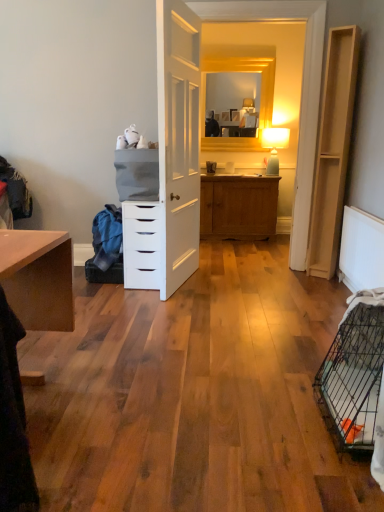
What do you see at coordinates (333, 150) in the screenshot?
I see `light wood/file cabinet at right` at bounding box center [333, 150].

Measure the distance between point (312,227) and camera.

The depth of point (312,227) is 3.80 meters.

This screenshot has width=384, height=512. Describe the element at coordinates (361, 250) in the screenshot. I see `white textured radiator at lower right` at that location.

What are the coordinates of `white matte chest of drawers at center` in the screenshot? It's located at (141, 244).

At what (x,y) coordinates should I click in order to perform the action: click on light wood/file cabinet at right. Please return your answer as a coordinate pair (x, y). This screenshot has height=512, width=384. Looking at the image, I should click on (333, 150).

From the image's perspective, which is above, white textured radiator at lower right or blue fabric at left?

From the image's view, blue fabric at left is above.

Is point (361, 237) more distant than point (98, 246)?

No, it is in front of (98, 246).

Is the position of white textured radiator at lower right more distant than that of blue fabric at left?

No, white textured radiator at lower right is closer to the camera.

Between white textured radiator at lower right and blue fabric at left, which one has smaller size?

Smaller between the two is white textured radiator at lower right.

From a real-world perspective, which object stands above the other?

From a 3D spatial view, light wood/file cabinet at right is above.

Would you say light wood/file cabinet at right is part of blue fabric at left's contents?

No, light wood/file cabinet at right is not inside blue fabric at left.

I want to click on material that appears behind the light wood/file cabinet at right, so click(107, 237).

Considering the relative sizes of black wire birdcage at lower right and white textured radiator at lower right in the image provided, is black wire birdcage at lower right smaller than white textured radiator at lower right?

Incorrect, black wire birdcage at lower right is not smaller in size than white textured radiator at lower right.

Is black wire birdcage at lower right inside or outside of white textured radiator at lower right?

black wire birdcage at lower right is located beyond the bounds of white textured radiator at lower right.

Is point (340, 428) closer or farther from the camera than point (350, 222)?

Point (340, 428) appears to be closer to the viewer than point (350, 222).

Which of these two, white matte chest of drawers at center or light wood/file cabinet at right, stands shorter?

Standing shorter between the two is white matte chest of drawers at center.

Between white matte chest of drawers at center and light wood/file cabinet at right, which one is positioned behind?

white matte chest of drawers at center is more distant.

Which of these two, white matte chest of drawers at center or blue fabric at left, is smaller?

blue fabric at left is smaller.

Considering the sizes of objects white matte chest of drawers at center and blue fabric at left in the image provided, who is thinner, white matte chest of drawers at center or blue fabric at left?

Thinner between the two is blue fabric at left.

In the image, is white matte chest of drawers at center positioned in front of or behind blue fabric at left?

Visually, white matte chest of drawers at center is located in front of blue fabric at left.

Does black wire birdcage at lower right have a lesser width compared to white matte chest of drawers at center?

Yes.

Is the surface of black wire birdcage at lower right in direct contact with white matte chest of drawers at center?

No, black wire birdcage at lower right is not with white matte chest of drawers at center.

Which of these two, black wire birdcage at lower right or white matte chest of drawers at center, is bigger?

white matte chest of drawers at center is bigger.

From a real-world perspective, which object stands above the other?

white matte chest of drawers at center is physically above.

Consider the image. Considering the relative positions of light wood/file cabinet at right and blue fabric at left in the image provided, is light wood/file cabinet at right to the left of blue fabric at left from the viewer's perspective?

No, light wood/file cabinet at right is not to the left of blue fabric at left.

Who is more distant, light wood/file cabinet at right or blue fabric at left?

blue fabric at left is behind.

Based on their sizes in the image, would you say light wood/file cabinet at right is bigger or smaller than blue fabric at left?

In the image, light wood/file cabinet at right appears to be larger than blue fabric at left.

Is light wood/file cabinet at right looking in the opposite direction of blue fabric at left?

No, blue fabric at left is not at the back of light wood/file cabinet at right.

Where is `material above the white textured radiator at lower right (from the image's perspective)`? This screenshot has height=512, width=384. material above the white textured radiator at lower right (from the image's perspective) is located at coordinates (107, 237).

Where is `file cabinet located above the blue fabric at left (from a real-world perspective)`? This screenshot has width=384, height=512. file cabinet located above the blue fabric at left (from a real-world perspective) is located at coordinates (333, 150).

Based on their spatial positions, is white textured radiator at lower right or light wood/file cabinet at right further from black wire birdcage at lower right?

Among the two, light wood/file cabinet at right is located further to black wire birdcage at lower right.

From the image, which object appears to be nearer to white matte chest of drawers at center, light wood/file cabinet at right or white textured radiator at lower right?

light wood/file cabinet at right lies closer to white matte chest of drawers at center than the other object.

Which object lies further to the anchor point light wood/file cabinet at right, white textured radiator at lower right or white matte chest of drawers at center?

white matte chest of drawers at center is further to light wood/file cabinet at right.

When comparing their distances from white textured radiator at lower right, does white matte chest of drawers at center or light wood/file cabinet at right seem further?

white matte chest of drawers at center lies further to white textured radiator at lower right than the other object.

Looking at the image, which one is located closer to white textured radiator at lower right, blue fabric at left or white matte chest of drawers at center?

Based on the image, white matte chest of drawers at center appears to be nearer to white textured radiator at lower right.

Based on their spatial positions, is blue fabric at left or black wire birdcage at lower right further from light wood/file cabinet at right?

black wire birdcage at lower right.

Considering their positions, is white matte chest of drawers at center positioned closer to black wire birdcage at lower right than blue fabric at left?

The object closer to black wire birdcage at lower right is white matte chest of drawers at center.

Considering their positions, is black wire birdcage at lower right positioned closer to white matte chest of drawers at center than white textured radiator at lower right?

white textured radiator at lower right.

Image resolution: width=384 pixels, height=512 pixels. In order to click on bird cage located between blue fabric at left and white textured radiator at lower right in the left-right direction in this screenshot , I will do `click(353, 373)`.

At what (x,y) coordinates should I click in order to perform the action: click on chest of drawers between black wire birdcage at lower right and blue fabric at left along the z-axis. Please return your answer as a coordinate pair (x, y). The width and height of the screenshot is (384, 512). Looking at the image, I should click on (141, 244).

Find the location of a particular element. The height and width of the screenshot is (512, 384). file cabinet between white matte chest of drawers at center and white textured radiator at lower right in the horizontal direction is located at coordinates (333, 150).

Image resolution: width=384 pixels, height=512 pixels. Identify the location of radiator between black wire birdcage at lower right and light wood/file cabinet at right from front to back. (361, 250).